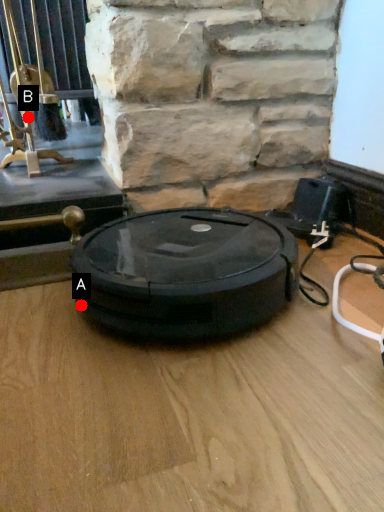
Question: Two points are circled on the image, labeled by A and B beside each circle. Among these points, which one is farthest from the camera?

Choices:
 (A) A is further
 (B) B is further

Answer: (B)